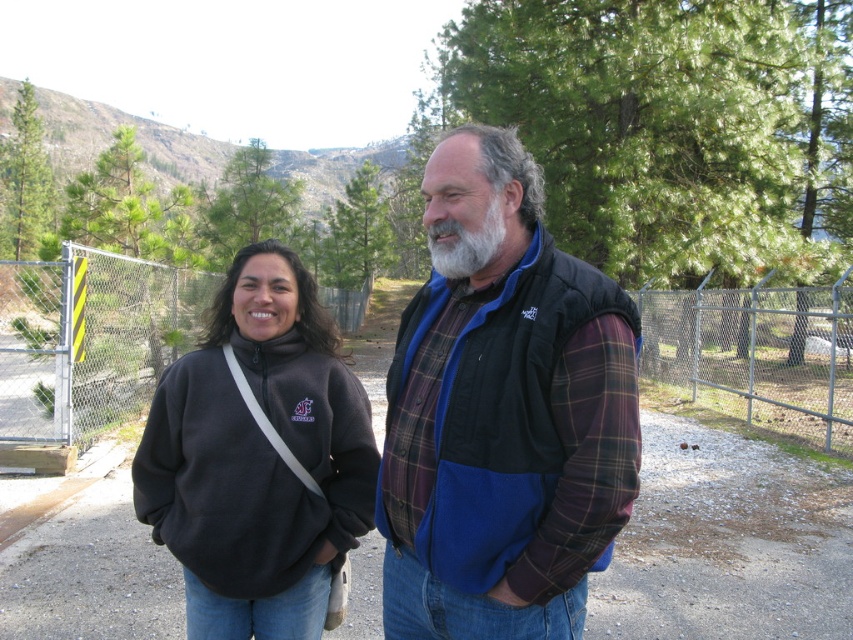
Based on the photo, how distant is plaid fleece vest at center from graywoollybeard at center?

The distance of plaid fleece vest at center from graywoollybeard at center is 15.00 inches.

Consider the image. Between plaid fleece vest at center and graywoollybeard at center, which one is positioned lower?

plaid fleece vest at center

Identify the location of plaid fleece vest at center. (502, 412).

You are a GUI agent. You are given a task and a screenshot of the screen. Output one action in this format:
    pyautogui.click(x=<x>, y=<y>)
    Task: Click on the plaid fleece vest at center
    This screenshot has width=853, height=640.
    Given the screenshot: What is the action you would take?
    pyautogui.click(x=502, y=412)

Does dark fleece sweatshirt at center have a lesser width compared to metal chain-link fence at left?

Correct, dark fleece sweatshirt at center's width is less than metal chain-link fence at left's.

Is point (231, 301) farther from viewer compared to point (126, 282)?

That is False.

Is point (357, 404) positioned behind point (114, 316)?

No, (357, 404) is closer to viewer.

Where is `dark fleece sweatshirt at center`? dark fleece sweatshirt at center is located at coordinates (259, 458).

Who is positioned more to the left, plaid fleece vest at center or dark fleece sweatshirt at center?

dark fleece sweatshirt at center is more to the left.

Who is shorter, plaid fleece vest at center or dark fleece sweatshirt at center?

dark fleece sweatshirt at center

Locate an element on the screen. The height and width of the screenshot is (640, 853). plaid fleece vest at center is located at coordinates (502, 412).

Where is `plaid fleece vest at center`? This screenshot has height=640, width=853. plaid fleece vest at center is located at coordinates (502, 412).